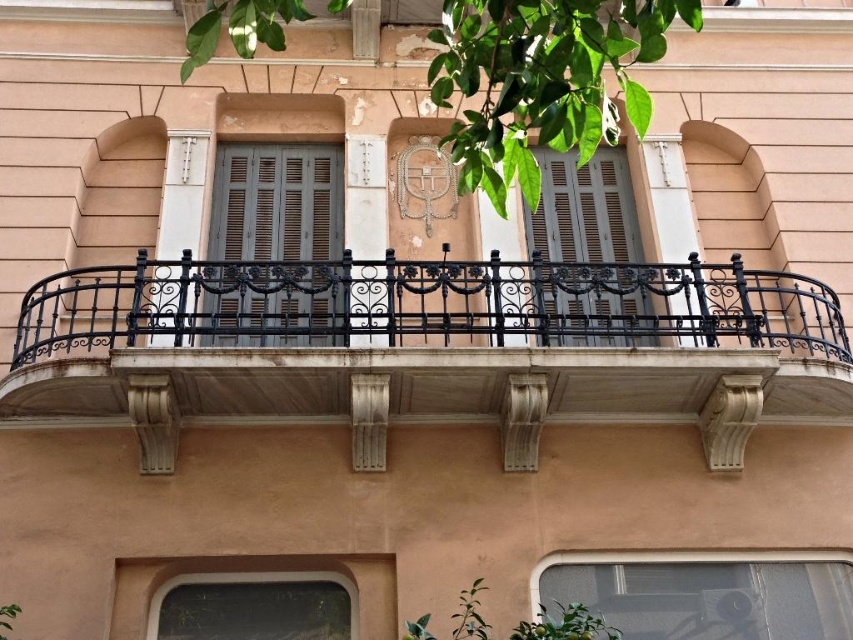
Is matte gray wood shutter at center below transparent glass window at lower right?

Actually, matte gray wood shutter at center is above transparent glass window at lower right.

Between matte gray wood shutter at center and transparent glass window at lower right, which one has less height?

Standing shorter between the two is transparent glass window at lower right.

Does point (234, 186) come in front of point (721, 621)?

No.

The image size is (853, 640). I want to click on matte gray wood shutter at center, so click(x=274, y=246).

Is the position of matte gray wood shutter at center more distant than that of clear glass window at lower center?

Yes.

Identify the location of matte gray wood shutter at center. Image resolution: width=853 pixels, height=640 pixels. (274, 246).

Where is `matte gray wood shutter at center`? Image resolution: width=853 pixels, height=640 pixels. matte gray wood shutter at center is located at coordinates (274, 246).

Does point (479, 339) come in front of point (299, 634)?

That is False.

Is point (628, 348) behind point (326, 600)?

No, it is in front of (326, 600).

Find the location of a particular element. The width and height of the screenshot is (853, 640). black wrought iron balcony at center is located at coordinates (427, 346).